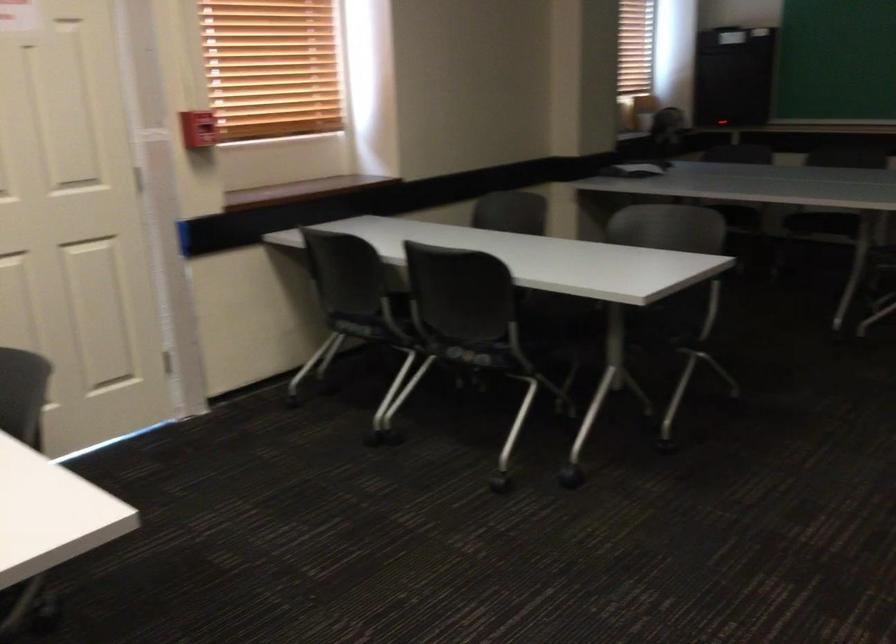
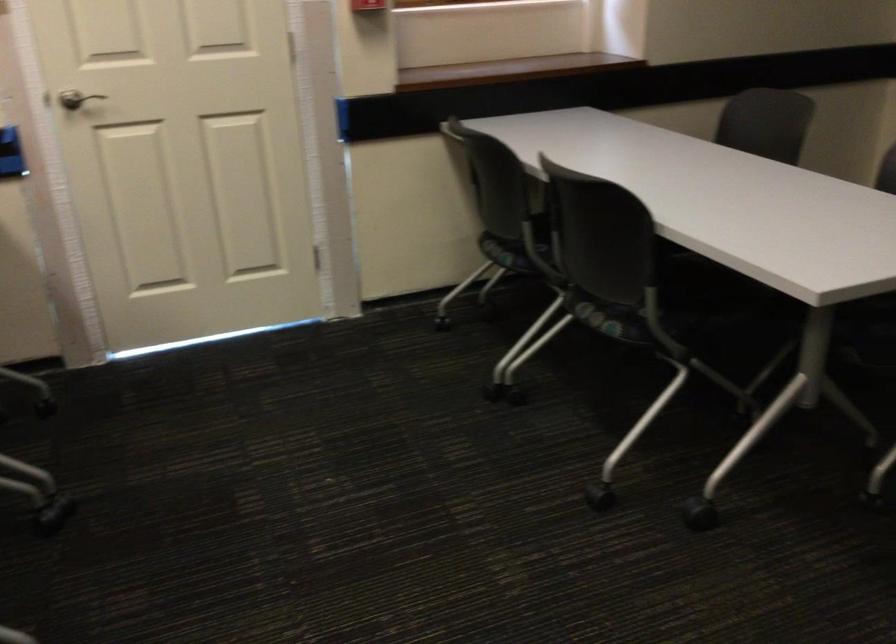
Question: How did the camera likely rotate?

Choices:
 (A) Left
 (B) Right
 (C) Up
 (D) Down

Answer: (A)